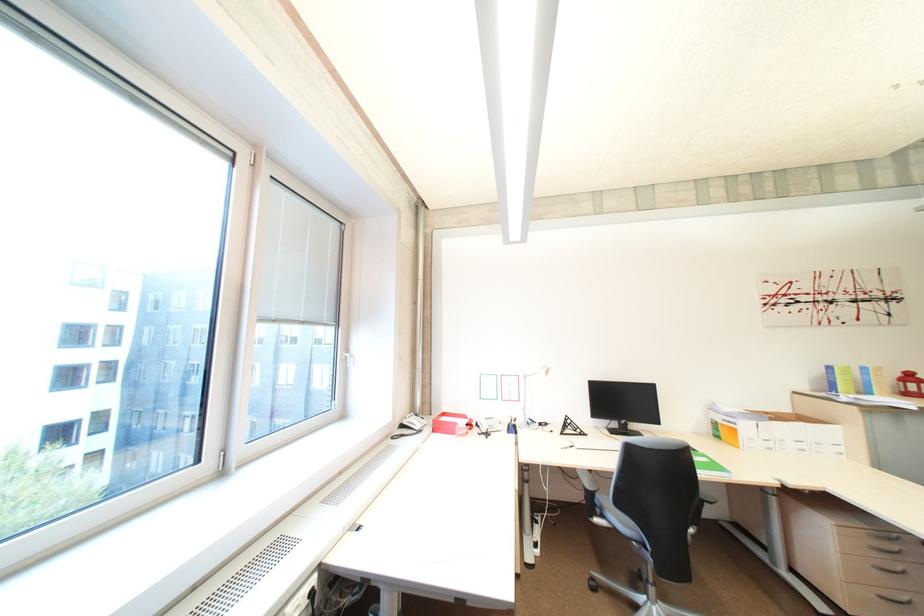
What do you see at coordinates (708, 464) in the screenshot?
I see `the green notebook` at bounding box center [708, 464].